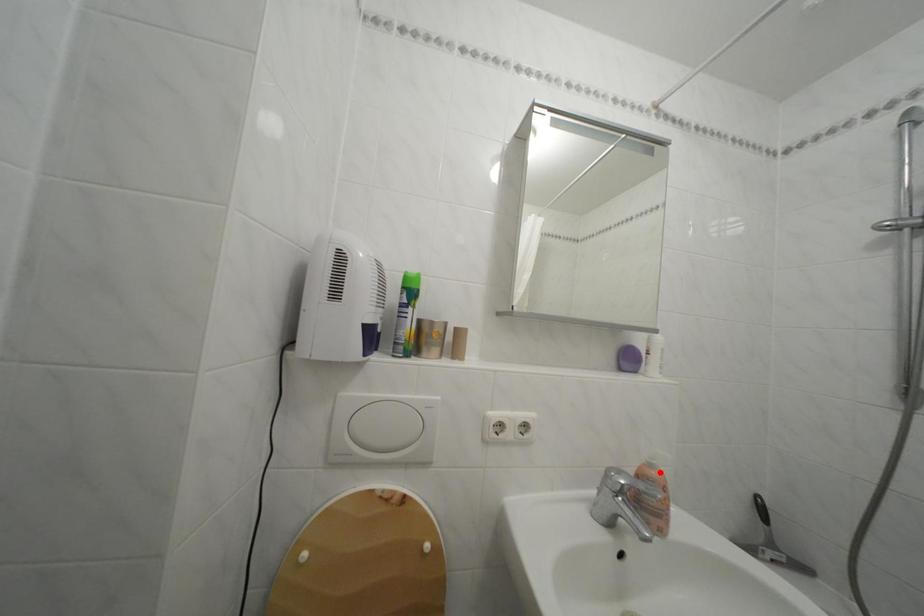
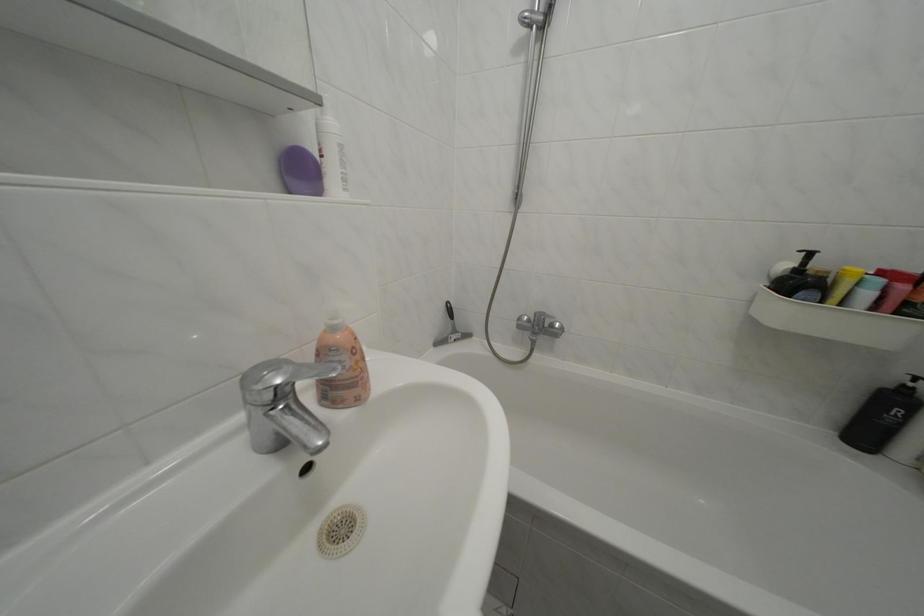
In the second image, find the point that corresponds to the highlighted location in the first image.

(342, 334)